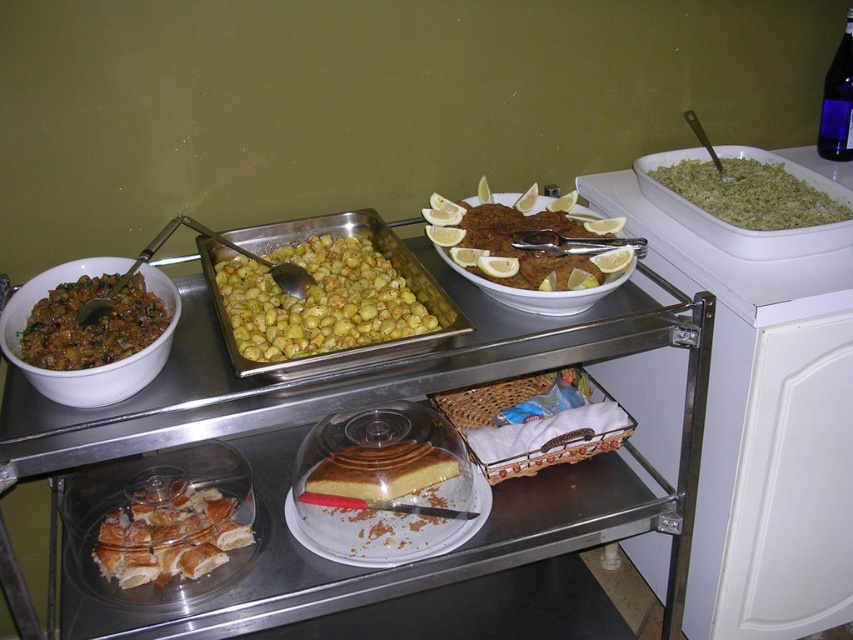
Describe the element at coordinates (91, 324) in the screenshot. The image size is (853, 640). I see `brown matte rice at left` at that location.

From the picture: Which is below, brown matte rice at left or yellow sponge cake at center?

yellow sponge cake at center

Is point (61, 324) more distant than point (357, 477)?

No, it is not.

What are the coordinates of `brown matte rice at left` in the screenshot? It's located at (91, 324).

Is the position of metallic silver tray at center more distant than that of yellow sponge cake at center?

No, metallic silver tray at center is closer to the viewer.

Does metallic silver tray at center appear under yellow sponge cake at center?

No.

Which is behind, point (265, 609) or point (422, 483)?

The point (422, 483) is more distant.

Locate an element on the screen. Image resolution: width=853 pixels, height=640 pixels. metallic silver tray at center is located at coordinates (393, 397).

Can you confirm if yellow/golden/glistening potatoes at center is shorter than golden brown croissant at lower left?

No.

Which of these two, yellow/golden/glistening potatoes at center or golden brown croissant at lower left, stands shorter?

Standing shorter between the two is golden brown croissant at lower left.

Does point (335, 257) come closer to viewer compared to point (190, 524)?

No, it is not.

You are a GUI agent. You are given a task and a screenshot of the screen. Output one action in this format:
    pyautogui.click(x=<x>, y=<y>)
    Task: Click on the yellow/golden/glistening potatoes at center
    
    Given the screenshot: What is the action you would take?
    pyautogui.click(x=318, y=301)